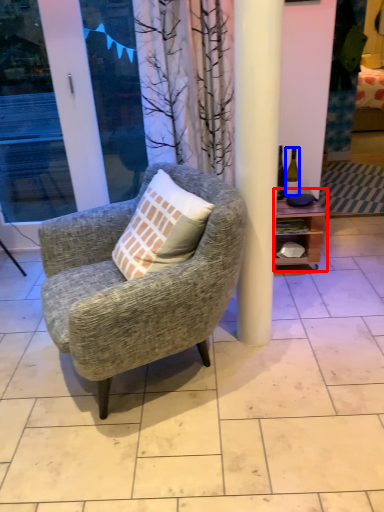
Question: Which object is closer to the camera taking this photo, shelf (highlighted by a red box) or bottle (highlighted by a blue box)?

Choices:
 (A) shelf
 (B) bottle

Answer: (A)